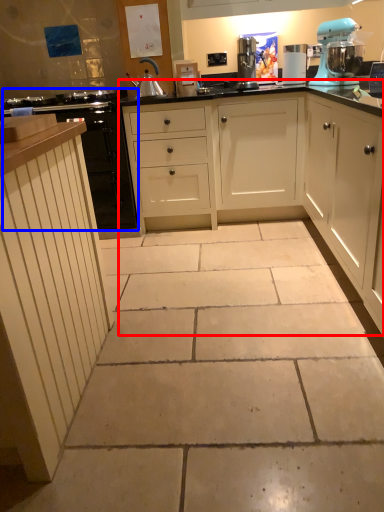
Question: Which of the following is the farthest to the observer, cabinetry (highlighted by a red box) or cabinetry (highlighted by a blue box)?

Choices:
 (A) cabinetry
 (B) cabinetry

Answer: (B)